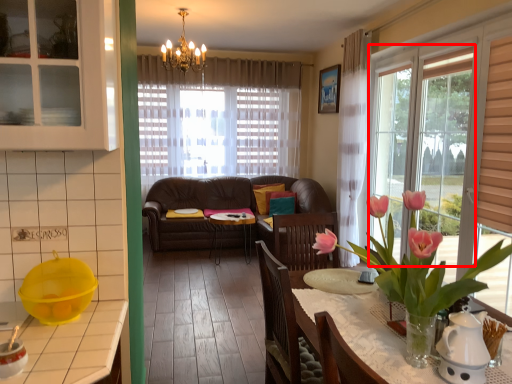
Question: Where is window (annotated by the red box) located in relation to cabinetry in the image?

Choices:
 (A) right
 (B) left

Answer: (A)